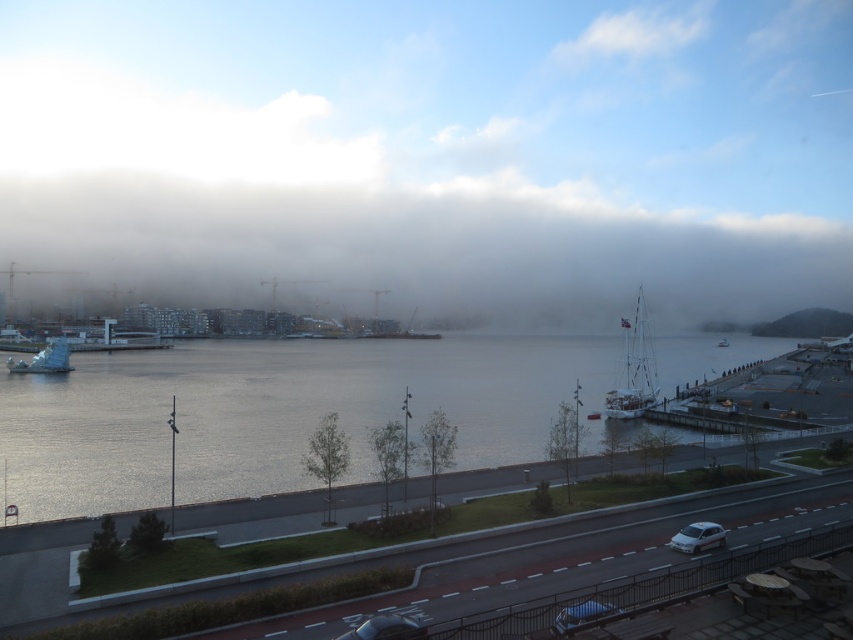
You are standing on the waterfront walkway and want to know which of the two points, point (578, 605) or point (24, 364), is nearer to you. Can you determine this based on the scene?

Point (578, 605) is closer to the viewer than point (24, 364).

You are standing on the waterfront walkway and notice a specific point in the scene. Based on the coordinates provided, can you identify what is located at point [436,154]?

The point [436,154] indicates white fluffy fog at center.

You are a pedestrian standing on the walkway and want to take a photo of the blue matte car at lower center without the white fluffy fog at center in the background. Is the fog blocking the view of the car?

The white fluffy fog at center is located above the blue matte car at lower center, so the fog is not blocking the view of the car. You can take the photo without the fog in the background.